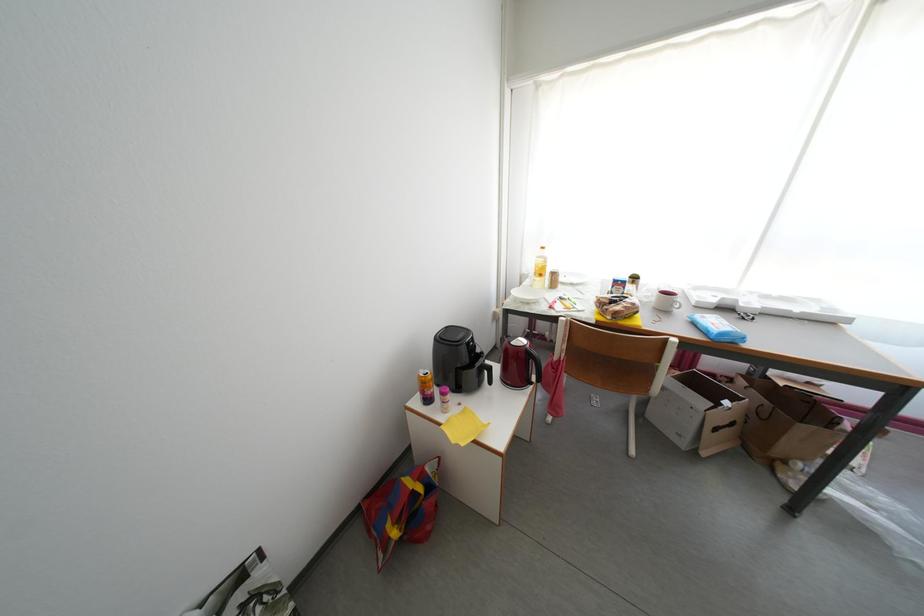
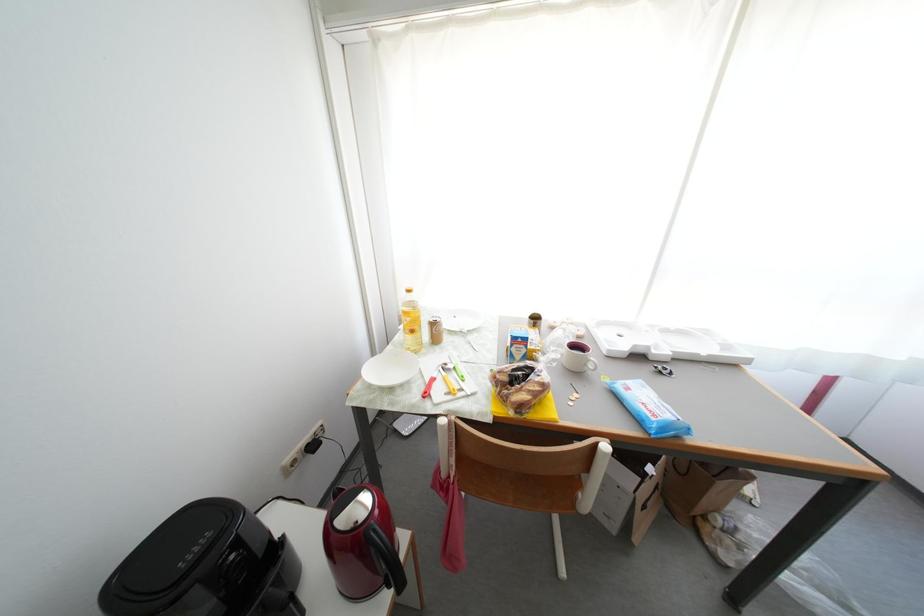
Consider the image. What movement of the cameraman would produce the second image?

The movement direction of the cameraman is right, forward.